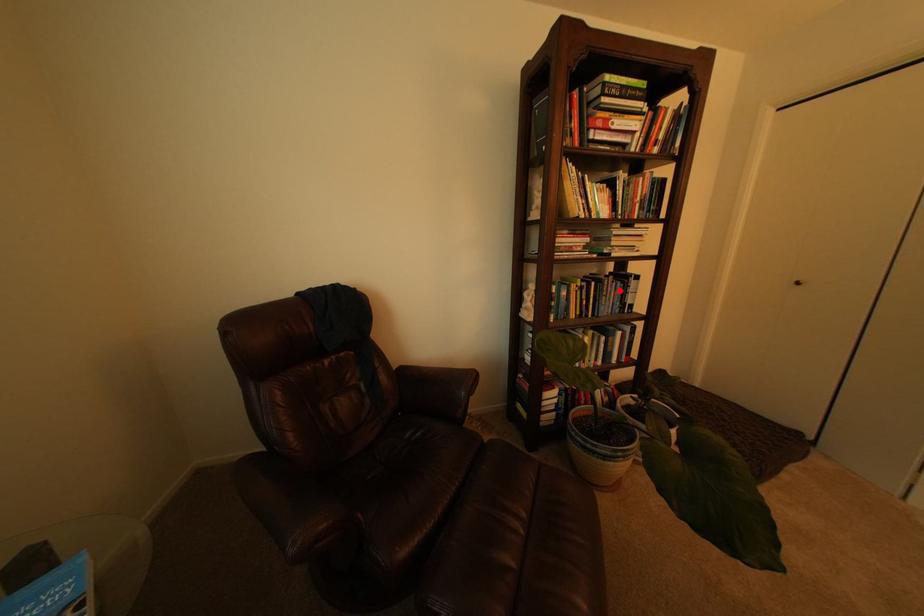
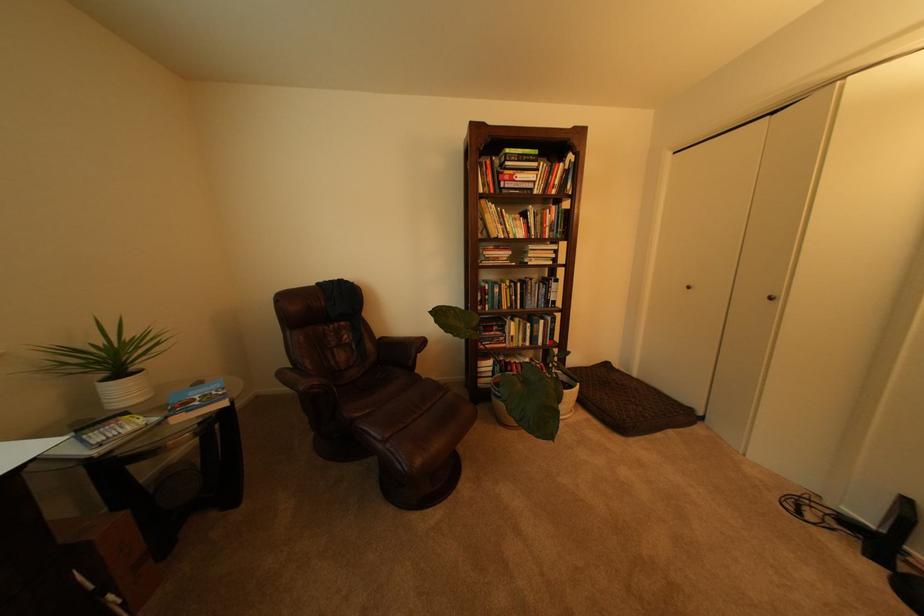
Question: I am providing you with two images of the same scene from different viewpoints. A red point is marked on the first image. Can you still see the location of the red point in image 2?

Choices:
 (A) Yes
 (B) No

Answer: (A)